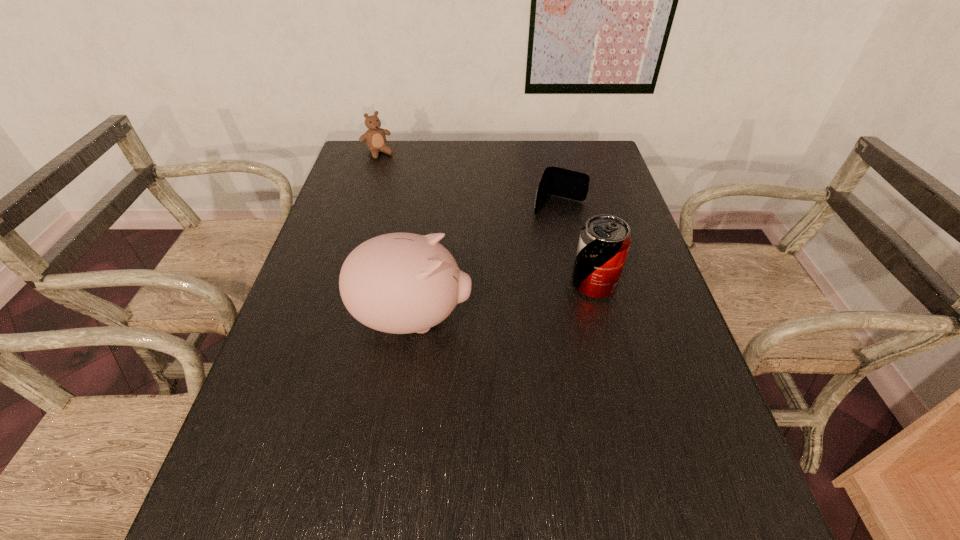
The height and width of the screenshot is (540, 960). I want to click on free space on the desktop that is between the piggy bank and the soda can and is positioned on the front-facing side of the farthest object, so click(502, 301).

Image resolution: width=960 pixels, height=540 pixels. What are the coordinates of `free spot on the desktop that is between the tallest object and the soda can and is positioned on the outer surface of the third nearest object` in the screenshot? It's located at (522, 298).